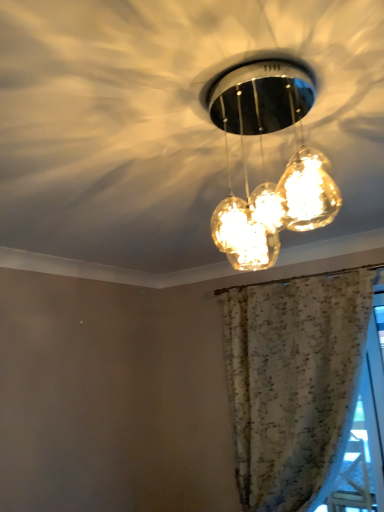
What is the approximate width of translucent glass pendant lights at center?

translucent glass pendant lights at center is 10.12 inches wide.

What do you see at coordinates (262, 96) in the screenshot? I see `translucent glass pendant lights at center` at bounding box center [262, 96].

Where is `translucent glass pendant lights at center`? This screenshot has height=512, width=384. translucent glass pendant lights at center is located at coordinates (262, 96).

Locate an element on the screen. The width and height of the screenshot is (384, 512). floral fabric curtain at upper center is located at coordinates (294, 383).

This screenshot has height=512, width=384. Describe the element at coordinates (294, 383) in the screenshot. I see `floral fabric curtain at upper center` at that location.

At what (x,y) coordinates should I click in order to perform the action: click on translucent glass pendant lights at center. Please return your answer as a coordinate pair (x, y). Looking at the image, I should click on (262, 96).

Which is more to the right, translucent glass pendant lights at center or floral fabric curtain at upper center?

floral fabric curtain at upper center.

Considering the positions of objects translucent glass pendant lights at center and floral fabric curtain at upper center in the image provided, who is behind, translucent glass pendant lights at center or floral fabric curtain at upper center?

floral fabric curtain at upper center is more distant.

Considering the points (285, 214) and (341, 303), which point is behind, point (285, 214) or point (341, 303)?

Positioned behind is point (341, 303).

Consider the image. From the image's perspective, would you say translucent glass pendant lights at center is shown under floral fabric curtain at upper center?

No, from the image's perspective, translucent glass pendant lights at center is not beneath floral fabric curtain at upper center.

From a real-world perspective, between translucent glass pendant lights at center and floral fabric curtain at upper center, who is vertically higher?

translucent glass pendant lights at center is physically above.

Considering the relative sizes of translucent glass pendant lights at center and floral fabric curtain at upper center in the image provided, is translucent glass pendant lights at center wider than floral fabric curtain at upper center?

In fact, translucent glass pendant lights at center might be narrower than floral fabric curtain at upper center.

Is translucent glass pendant lights at center shorter than floral fabric curtain at upper center?

Yes.

Does translucent glass pendant lights at center have a larger size compared to floral fabric curtain at upper center?

Actually, translucent glass pendant lights at center might be smaller than floral fabric curtain at upper center.

Is translucent glass pendant lights at center positioned beyond the bounds of floral fabric curtain at upper center?

Yes, translucent glass pendant lights at center is outside of floral fabric curtain at upper center.

Is translucent glass pendant lights at center directly adjacent to floral fabric curtain at upper center?

No, translucent glass pendant lights at center is not with floral fabric curtain at upper center.

Could you tell me if translucent glass pendant lights at center is turned towards floral fabric curtain at upper center?

No, translucent glass pendant lights at center is not turned towards floral fabric curtain at upper center.

Identify the location of curtain that appears below the translucent glass pendant lights at center (from a real-world perspective). tap(294, 383).

Based on the photo, in the image, is floral fabric curtain at upper center on the left side or the right side of translucent glass pendant lights at center?

Based on their positions, floral fabric curtain at upper center is located to the right of translucent glass pendant lights at center.

Which object is further away from the camera taking this photo, floral fabric curtain at upper center or translucent glass pendant lights at center?

floral fabric curtain at upper center is further from the camera.

Is point (304, 346) positioned behind point (270, 190)?

That is True.

From the image's perspective, is floral fabric curtain at upper center positioned above or below translucent glass pendant lights at center?

From the image's perspective, floral fabric curtain at upper center appears below translucent glass pendant lights at center.

From a real-world perspective, does floral fabric curtain at upper center sit lower than translucent glass pendant lights at center?

Yes, from a real-world perspective, floral fabric curtain at upper center is under translucent glass pendant lights at center.

Considering the relative sizes of floral fabric curtain at upper center and translucent glass pendant lights at center in the image provided, is floral fabric curtain at upper center thinner than translucent glass pendant lights at center?

No.

Is floral fabric curtain at upper center taller than translucent glass pendant lights at center?

Indeed, floral fabric curtain at upper center has a greater height compared to translucent glass pendant lights at center.

Considering the sizes of floral fabric curtain at upper center and translucent glass pendant lights at center in the image, is floral fabric curtain at upper center bigger or smaller than translucent glass pendant lights at center?

Considering their sizes, floral fabric curtain at upper center takes up more space than translucent glass pendant lights at center.

Looking at this image, is floral fabric curtain at upper center not inside translucent glass pendant lights at center?

Yes, floral fabric curtain at upper center is outside of translucent glass pendant lights at center.

Is floral fabric curtain at upper center next to translucent glass pendant lights at center?

No, floral fabric curtain at upper center is not in contact with translucent glass pendant lights at center.

Does floral fabric curtain at upper center turn towards translucent glass pendant lights at center?

Yes, floral fabric curtain at upper center is aimed at translucent glass pendant lights at center.

Can you tell me how much floral fabric curtain at upper center and translucent glass pendant lights at center differ in facing direction?

floral fabric curtain at upper center and translucent glass pendant lights at center are facing 9.37 degrees away from each other.

Could you measure the distance between floral fabric curtain at upper center and translucent glass pendant lights at center?

They are 1.31 meters apart.

Where is `curtain on the right of translucent glass pendant lights at center`? Image resolution: width=384 pixels, height=512 pixels. curtain on the right of translucent glass pendant lights at center is located at coordinates (294, 383).

Locate an element on the screen. The height and width of the screenshot is (512, 384). curtain beneath the translucent glass pendant lights at center (from a real-world perspective) is located at coordinates (294, 383).

In order to click on lamp above the floral fabric curtain at upper center (from a real-world perspective) in this screenshot , I will do `click(262, 96)`.